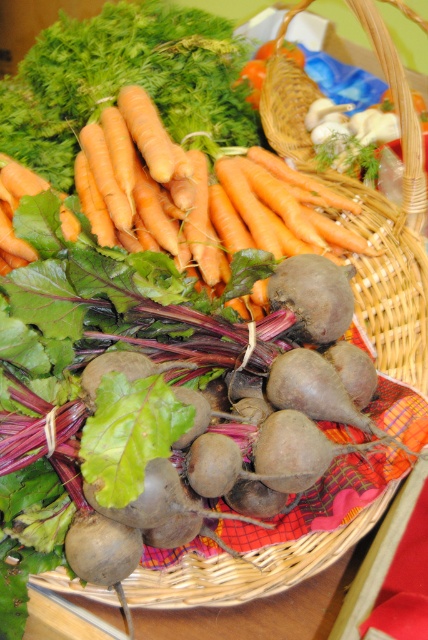
You are standing 30 inches away from a display of vegetables. You see an orange smooth carrot at upper center in the image. Can you reach it without moving closer?

The orange smooth carrot at upper center is 28.90 inches away from the viewer, so yes, you can reach it without moving closer since you are already within that distance.

You are a chef trying to reach the orange smooth carrot at upper center to prepare a dish. You are standing in front of the woven wicker basket at center. Can you easily grab the carrot without moving the basket?

The orange smooth carrot at upper center and the woven wicker basket at center are 10.18 inches apart. Since the distance is more than 10 inches, you can easily grab the carrot without moving the basket.

You are arranging vegetables in a kitchen. You have an orange smooth carrot at upper center and a woven wicker basket at center. If you want to place the carrot into the basket, which direction should you move the carrot relative to the basket?

The orange smooth carrot at upper center is to the left of the woven wicker basket at center, so you should move it to the right to place it into the basket.